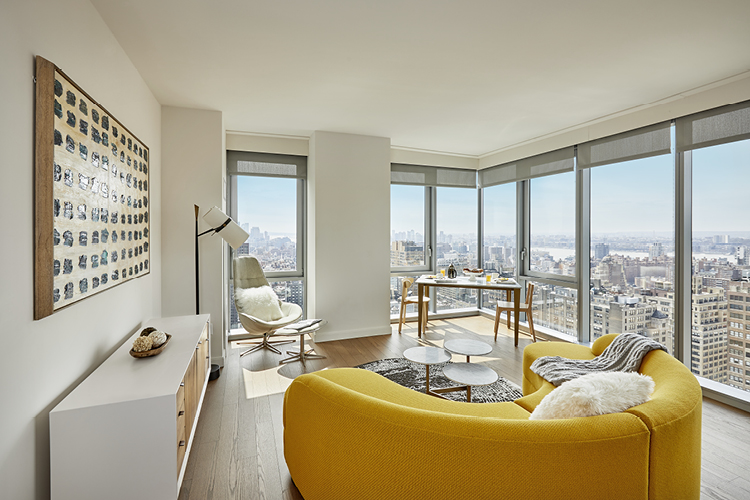
Find the location of `yellow couch`. yellow couch is located at coordinates (458, 449).